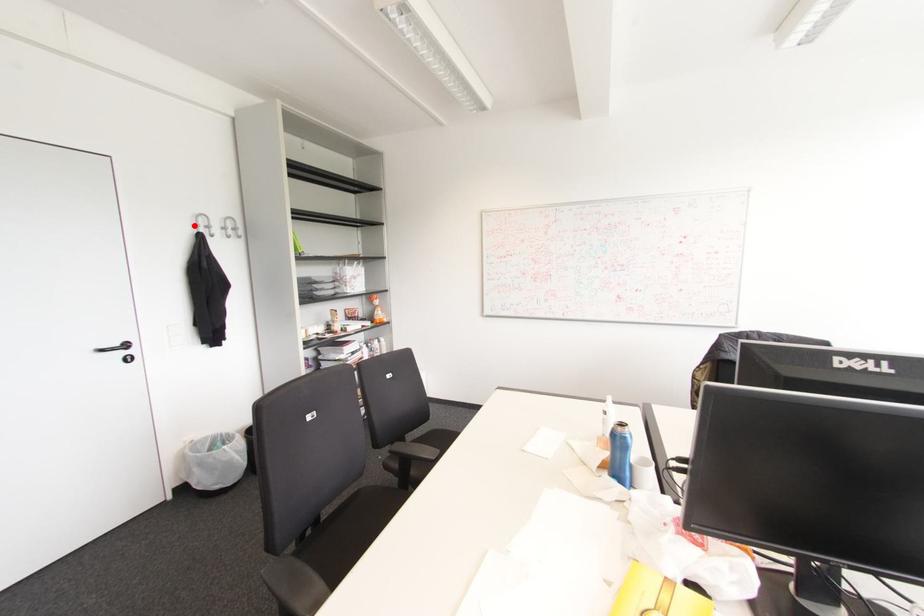
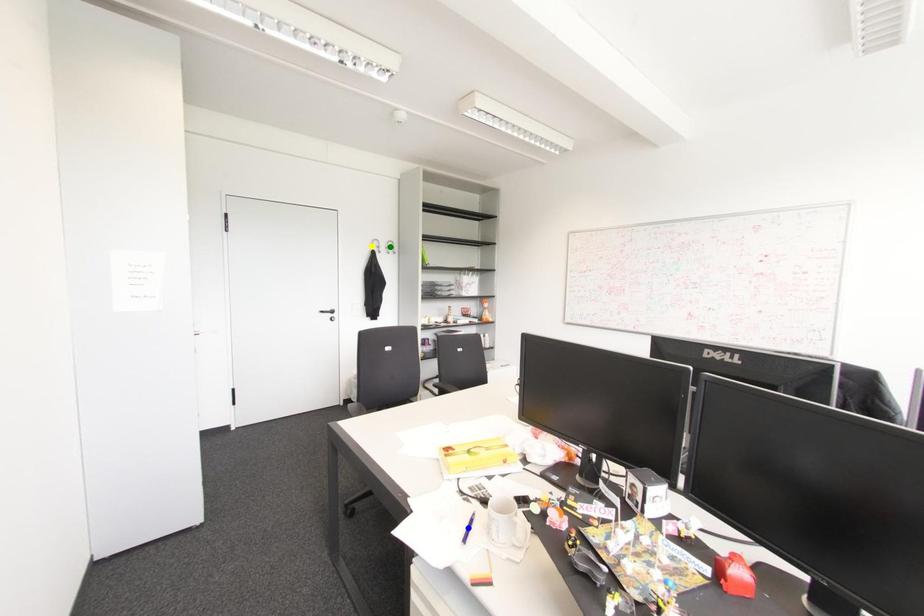
Question: I am providing you with two images of the same scene from different viewpoints. A red point is marked on the first image. You are given multiple points on the second image. In image 2, which mark is for the same physical point as the one in image 1?

Choices:
 (A) green point
 (B) yellow point
 (C) blue point

Answer: (B)